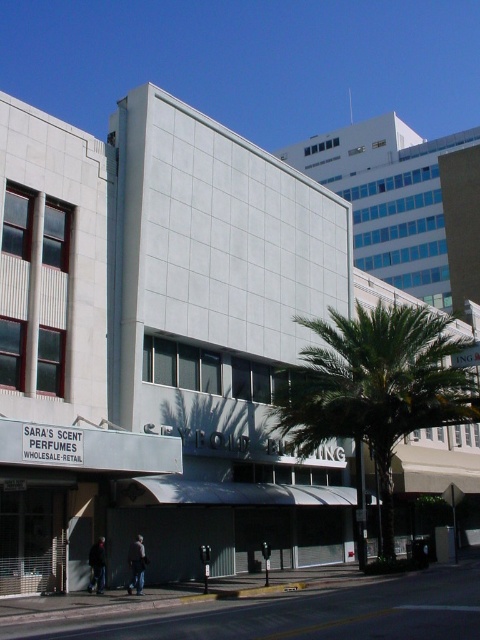
Can you confirm if dark gray jacket at lower center is thinner than dark gray jacket at lower left?

Yes, dark gray jacket at lower center is thinner than dark gray jacket at lower left.

Can you confirm if dark gray jacket at lower center is shorter than dark gray jacket at lower left?

Correct, dark gray jacket at lower center is not as tall as dark gray jacket at lower left.

Which is behind, point (134, 556) or point (98, 589)?

The point (98, 589) is behind.

Image resolution: width=480 pixels, height=640 pixels. I want to click on dark gray jacket at lower center, so pyautogui.click(x=136, y=564).

Is point (384, 435) positioned before point (135, 582)?

No, (384, 435) is further to viewer.

Identify the location of green leafy palm tree at center. (375, 388).

Looking at this image, between green leafy palm tree at center and dark gray jacket at lower left, which one is positioned lower?

dark gray jacket at lower left

Between green leafy palm tree at center and dark gray jacket at lower left, which one has less height?

With less height is dark gray jacket at lower left.

Who is more distant from viewer, (451, 413) or (98, 541)?

Point (451, 413)

I want to click on green leafy palm tree at center, so click(x=375, y=388).